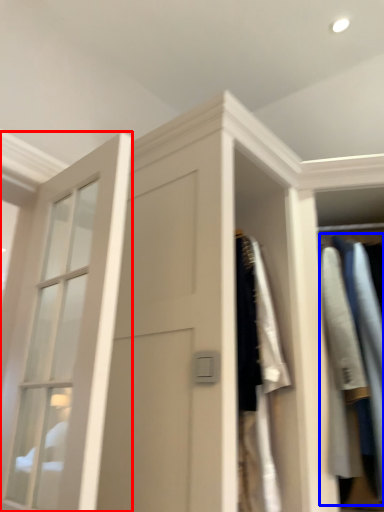
Question: Among these objects, which one is farthest to the camera, window (highlighted by a red box) or clothing (highlighted by a blue box)?

Choices:
 (A) window
 (B) clothing

Answer: (B)